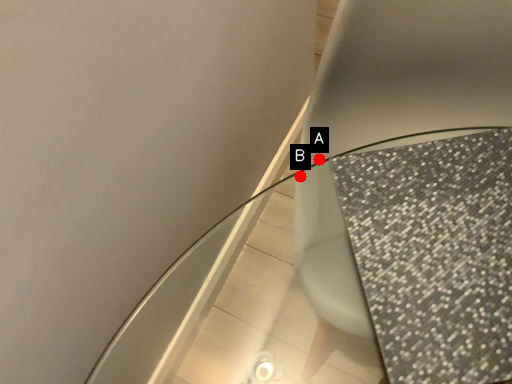
Question: Two points are circled on the image, labeled by A and B beside each circle. Which point is closer to the camera?

Choices:
 (A) A is closer
 (B) B is closer

Answer: (B)